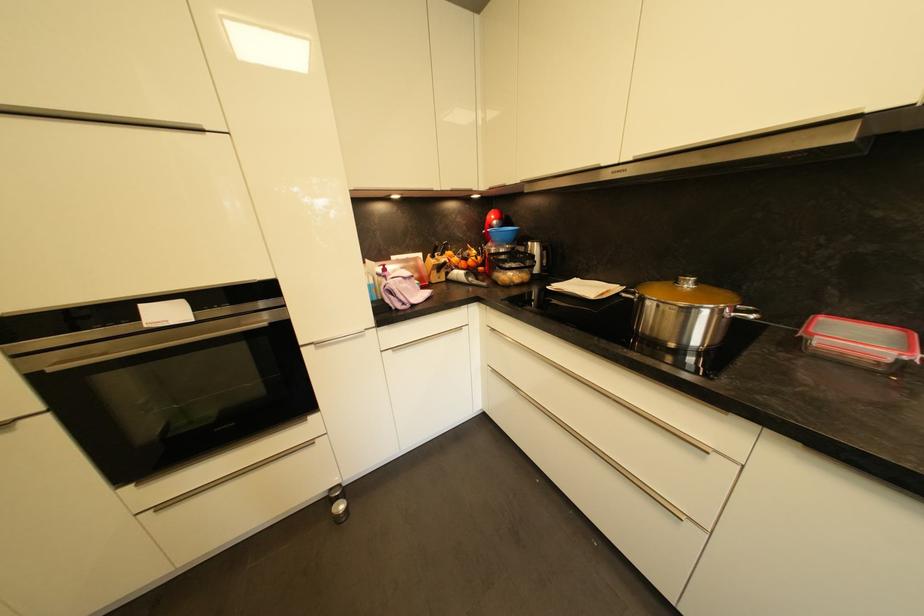
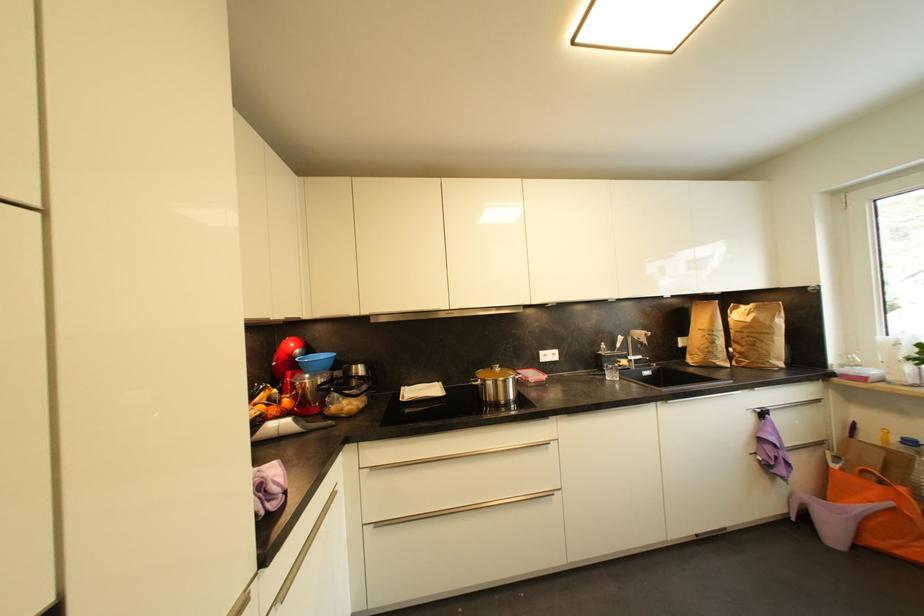
Locate, in the second image, the point that corresponds to [694,286] in the first image.

(503, 371)